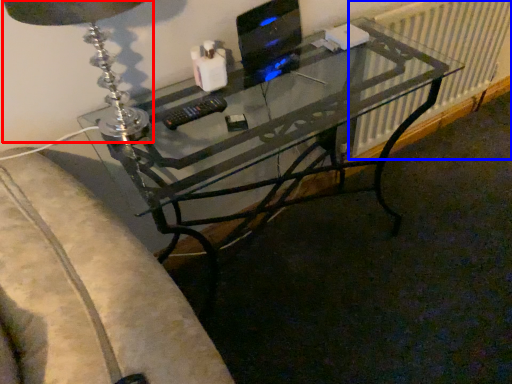
Question: Which object is further to the camera taking this photo, table lamp (highlighted by a red box) or radiator (highlighted by a blue box)?

Choices:
 (A) table lamp
 (B) radiator

Answer: (B)